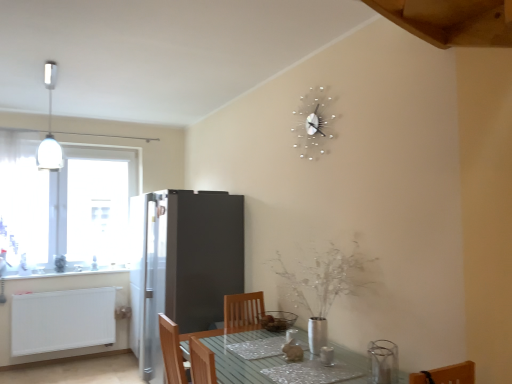
Find the location of a particular element. The height and width of the screenshot is (384, 512). free spot above clear glass table at lower center (from a real-world perspective) is located at coordinates (269, 355).